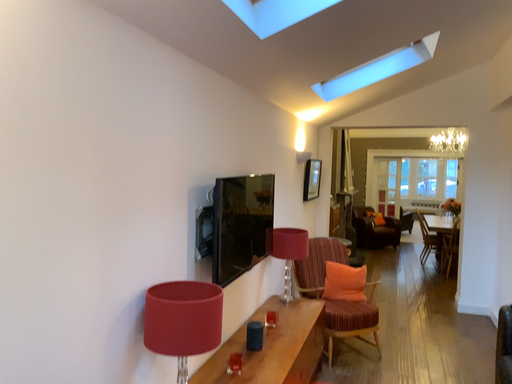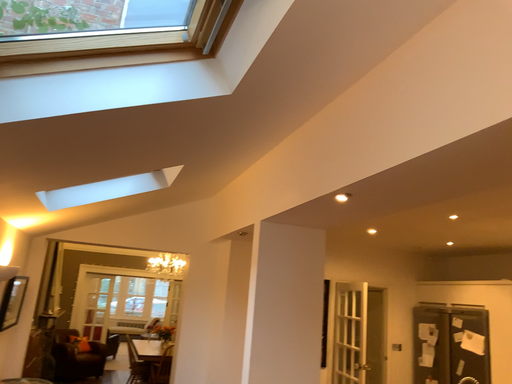
Question: Which way did the camera rotate in the video?

Choices:
 (A) rotated upward
 (B) rotated downward

Answer: (A)